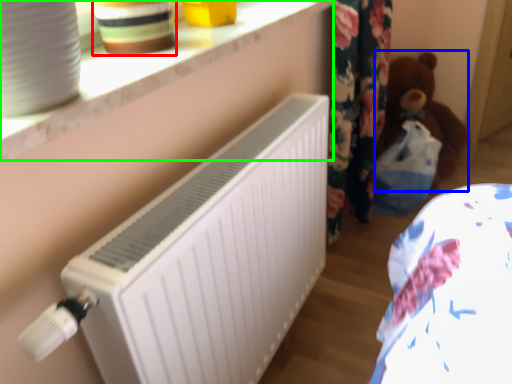
Question: Which is nearer to the pottery (highlighted by a red box)? teddy (highlighted by a blue box) or window sill (highlighted by a green box).

Choices:
 (A) teddy
 (B) window sill

Answer: (B)